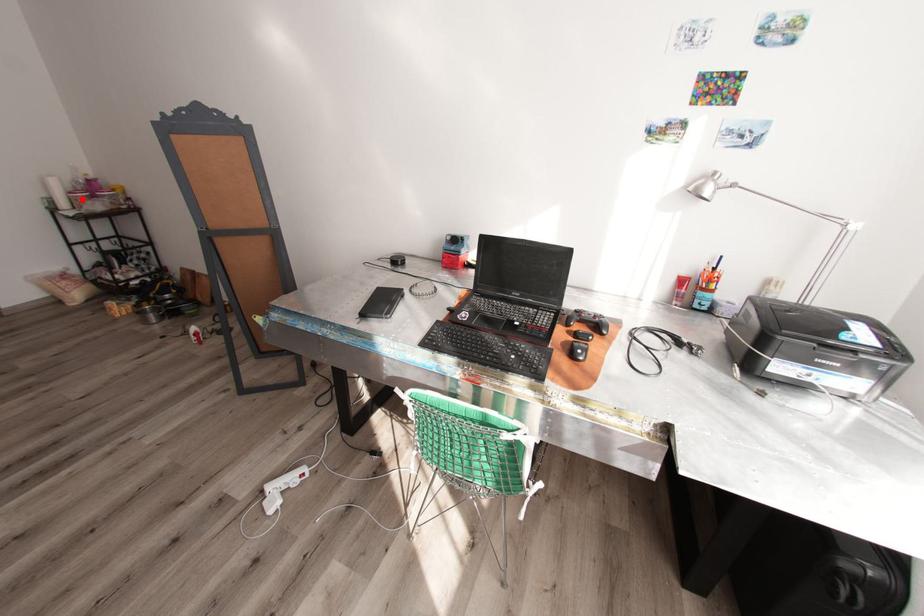
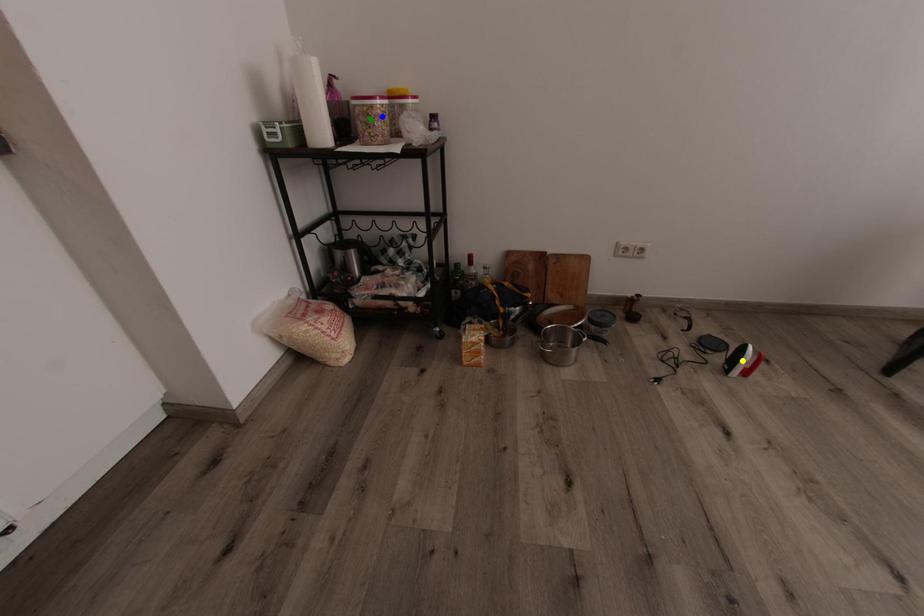
Question: I am providing you with two images of the same scene from different viewpoints. A red point is marked on the first image. You are given multiple points on the second image. Which point in image 2 represents the same 3d spot as the red point in image 1?

Choices:
 (A) yellow point
 (B) blue point
 (C) green point

Answer: (B)